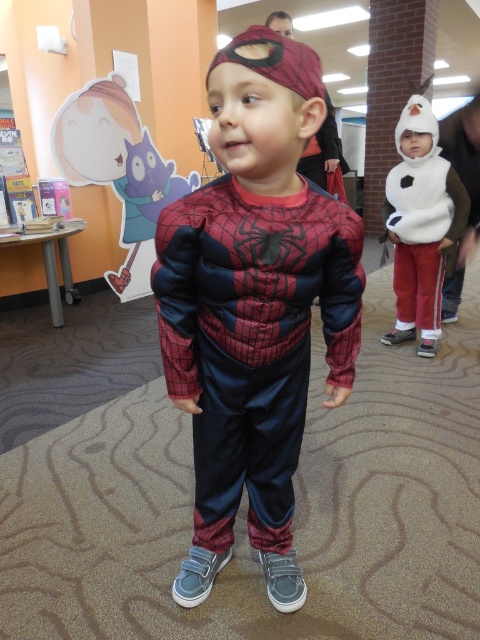
Which is more to the left, shiny satin spider-man costume at center or matte blue plush at left?

Positioned to the left is matte blue plush at left.

Between point (336, 257) and point (130, 164), which one is positioned behind?

Point (130, 164)

Find the location of a particular element. shiny satin spider-man costume at center is located at coordinates (254, 307).

Locate an element on the screen. Image resolution: width=480 pixels, height=640 pixels. shiny satin spider-man costume at center is located at coordinates (254, 307).

Which is behind, point (115, 81) or point (412, 244)?

Positioned behind is point (115, 81).

Identify the location of matte blue plush at left. The image size is (480, 640). (119, 170).

Does shiny satin spider-man costume at center appear over white fuzzy costume at right?

No, shiny satin spider-man costume at center is not above white fuzzy costume at right.

Between shiny satin spider-man costume at center and white fuzzy costume at right, which one appears on the left side from the viewer's perspective?

shiny satin spider-man costume at center

Locate an element on the screen. The image size is (480, 640). shiny satin spider-man costume at center is located at coordinates (254, 307).